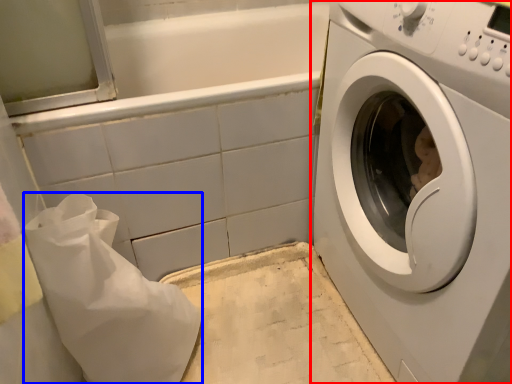
Question: Which point is closer to the camera, washing machine (highlighted by a red box) or material (highlighted by a blue box)?

Choices:
 (A) washing machine
 (B) material

Answer: (A)